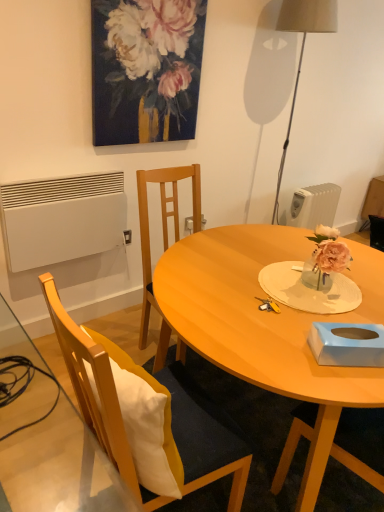
Question: Would you say blue cardboard tissue box at lower right contains oil paint canvas at upper center?

Choices:
 (A) no
 (B) yes

Answer: (A)

Question: Does blue cardboard tissue box at lower right lie in front of oil paint canvas at upper center?

Choices:
 (A) no
 (B) yes

Answer: (B)

Question: Considering the relative positions of blue cardboard tissue box at lower right and oil paint canvas at upper center in the image provided, is blue cardboard tissue box at lower right to the left of oil paint canvas at upper center from the viewer's perspective?

Choices:
 (A) yes
 (B) no

Answer: (B)

Question: Is blue cardboard tissue box at lower right outside oil paint canvas at upper center?

Choices:
 (A) no
 (B) yes

Answer: (B)

Question: Is blue cardboard tissue box at lower right aimed at oil paint canvas at upper center?

Choices:
 (A) yes
 (B) no

Answer: (B)

Question: Is blue cardboard tissue box at lower right to the right of oil paint canvas at upper center from the viewer's perspective?

Choices:
 (A) yes
 (B) no

Answer: (A)

Question: Can white matte radiator at lower left, the second radiator in the right-to-left sequence, be found inside blue cardboard tissue box at lower right?

Choices:
 (A) yes
 (B) no

Answer: (B)

Question: Considering the relative sizes of blue cardboard tissue box at lower right and white matte radiator at lower left, the second radiator in the right-to-left sequence, in the image provided, is blue cardboard tissue box at lower right smaller than white matte radiator at lower left, the second radiator in the right-to-left sequence,?

Choices:
 (A) no
 (B) yes

Answer: (B)

Question: Is blue cardboard tissue box at lower right next to white matte radiator at lower left, which is the first radiator in front-to-back order?

Choices:
 (A) no
 (B) yes

Answer: (A)

Question: Is blue cardboard tissue box at lower right facing away from white matte radiator at lower left, which is the first radiator in front-to-back order?

Choices:
 (A) no
 (B) yes

Answer: (A)

Question: Does blue cardboard tissue box at lower right appear on the left side of white matte radiator at lower left, the second radiator in the right-to-left sequence?

Choices:
 (A) no
 (B) yes

Answer: (A)

Question: Is blue cardboard tissue box at lower right positioned before white matte radiator at lower left, the 1th radiator when ordered from left to right?

Choices:
 (A) yes
 (B) no

Answer: (A)

Question: Is the position of wooden chair at left less distant than that of blue cardboard tissue box at lower right?

Choices:
 (A) yes
 (B) no

Answer: (A)